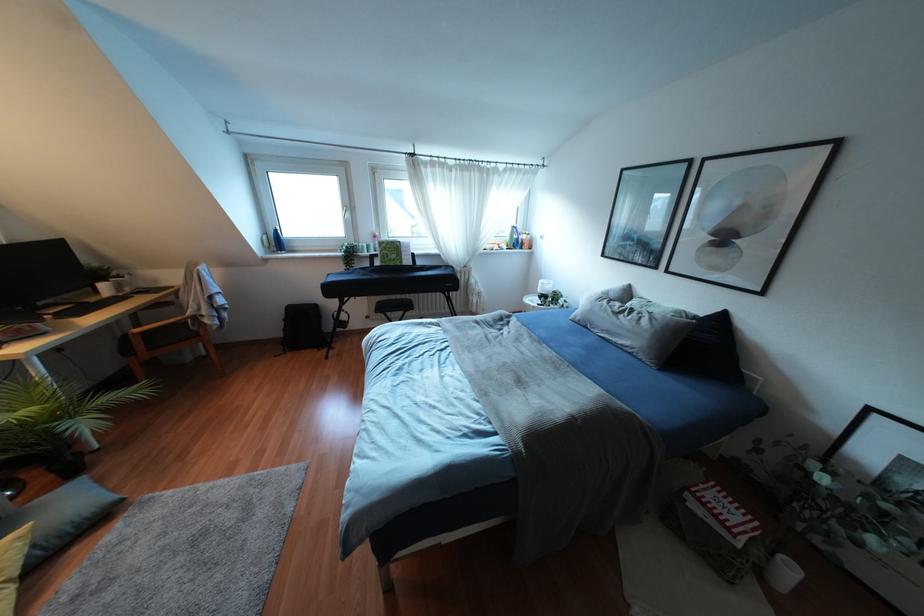
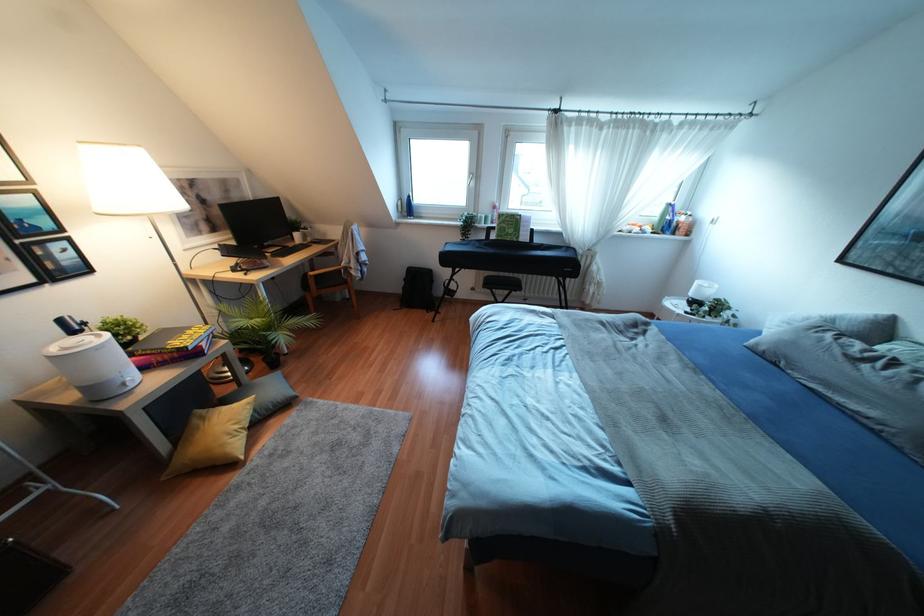
The images are taken continuously from a first-person perspective. In which direction are you moving?

The cameraman walked toward left, forward.